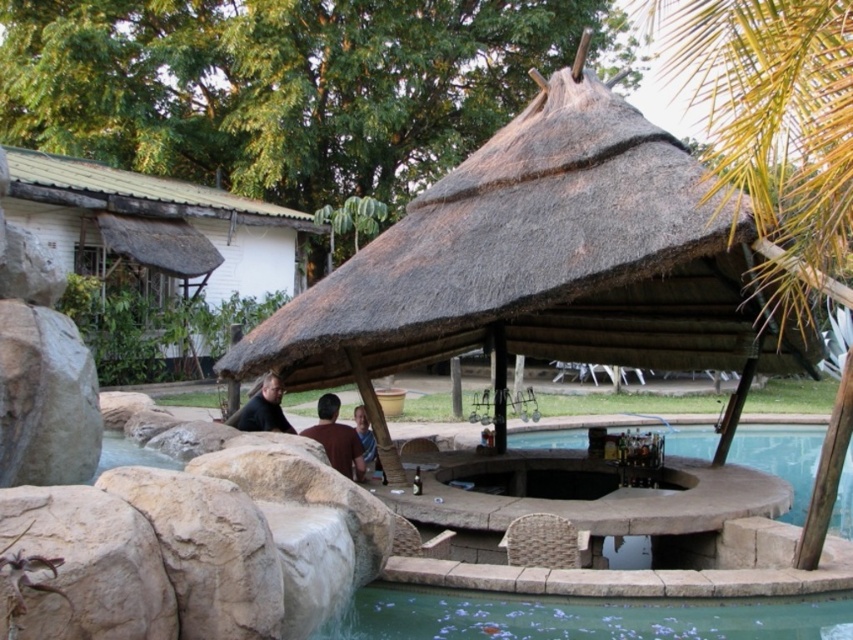
Question: Observing the image, what is the correct spatial positioning of thatched roof hut at left in reference to clear water at pool bottom?

Choices:
 (A) left
 (B) right

Answer: (A)

Question: Which object is the closest to the dark brown leather jacket at center?

Choices:
 (A) clear water at pool bottom
 (B) green leafy palm tree at upper center

Answer: (A)

Question: Which point is closer to the camera taking this photo?

Choices:
 (A) (288, 426)
 (B) (369, 435)

Answer: (A)

Question: Can you confirm if green leafy palm tree at upper center is wider than dark brown leather jacket at center?

Choices:
 (A) no
 (B) yes

Answer: (A)

Question: Is green leafy palm tree at upper center bigger than dark brown leather jacket at center?

Choices:
 (A) no
 (B) yes

Answer: (A)

Question: Which object is farther from the camera taking this photo?

Choices:
 (A) dark brown leather jacket at center
 (B) blue denim shirt at center
 (C) brown leather chair at center

Answer: (A)